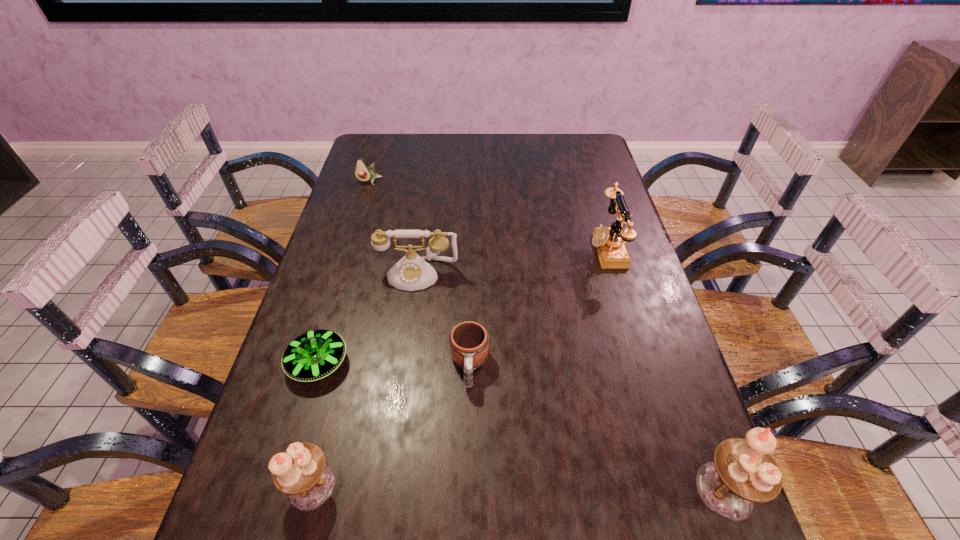
Identify the location of the left candle holder. This screenshot has height=540, width=960. (301, 472).

Locate an element on the screen. the taller candle holder is located at coordinates (743, 472).

The width and height of the screenshot is (960, 540). I want to click on the right candle holder, so click(743, 472).

Where is `the farthest object`? This screenshot has width=960, height=540. the farthest object is located at coordinates (363, 173).

I want to click on the fourth shortest object, so click(x=412, y=272).

Locate an element on the screen. the left telephone is located at coordinates (412, 272).

You are a GUI agent. You are given a task and a screenshot of the screen. Output one action in this format:
    pyautogui.click(x=<x>, y=<y>)
    Task: Click on the mug
    
    Given the screenshot: What is the action you would take?
    pyautogui.click(x=468, y=341)

Identify the location of the right telephone. (609, 241).

This screenshot has width=960, height=540. Identify the location of saucer. (315, 354).

The image size is (960, 540). I want to click on free space located on the back of the shorter candle holder, so click(346, 350).